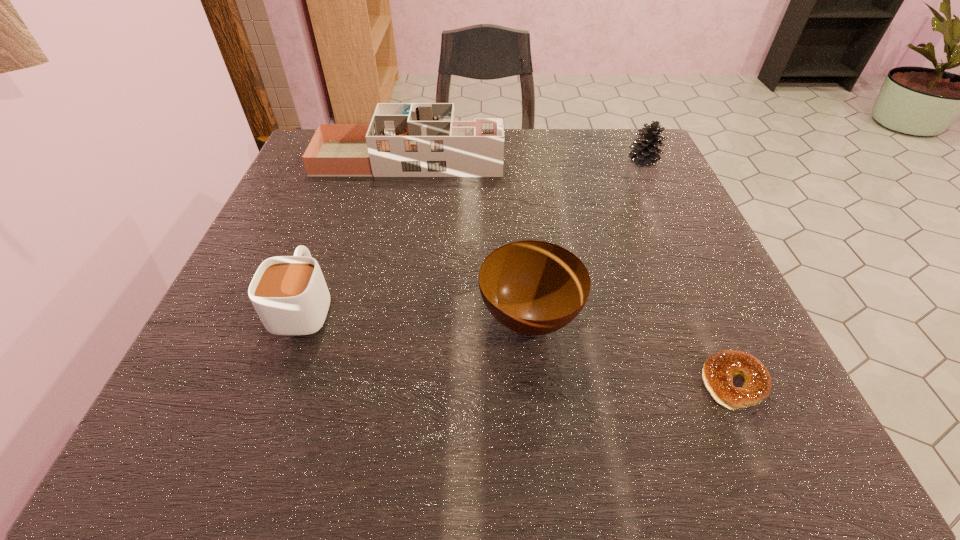
Identify the location of free space in the image that satisfies the following two spatial constraints: 1. on the side with the handle of the pinecone; 2. on the right side of the cup. (357, 161).

Identify the location of free location that satisfies the following two spatial constraints: 1. at the entrance of the bagel; 2. on the left side of the dollhouse. (362, 383).

The width and height of the screenshot is (960, 540). In order to click on free location that satisfies the following two spatial constraints: 1. at the entrance of the dollhouse; 2. on the back side of the pinecone in this screenshot , I will do click(x=408, y=161).

You are a GUI agent. You are given a task and a screenshot of the screen. Output one action in this format:
    pyautogui.click(x=<x>, y=<y>)
    Task: Click on the blank space that satisfies the following two spatial constraints: 1. at the entrance of the bowl; 2. on the left side of the dollhouse
    The width and height of the screenshot is (960, 540).
    Given the screenshot: What is the action you would take?
    tap(375, 317)

The height and width of the screenshot is (540, 960). Find the location of `vacant region that satisfies the following two spatial constraints: 1. on the back side of the pinecone; 2. on the left side of the bowl`. vacant region that satisfies the following two spatial constraints: 1. on the back side of the pinecone; 2. on the left side of the bowl is located at coordinates (514, 161).